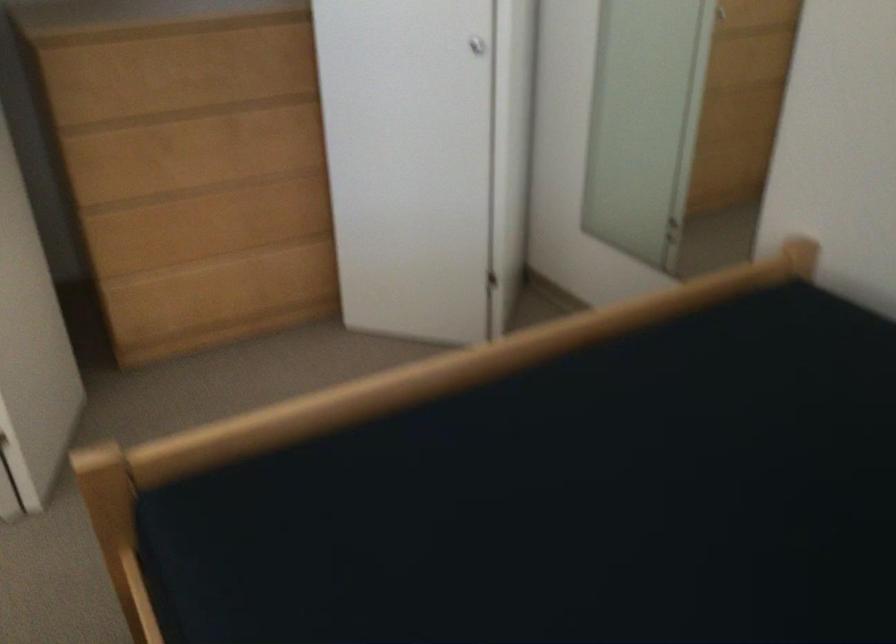
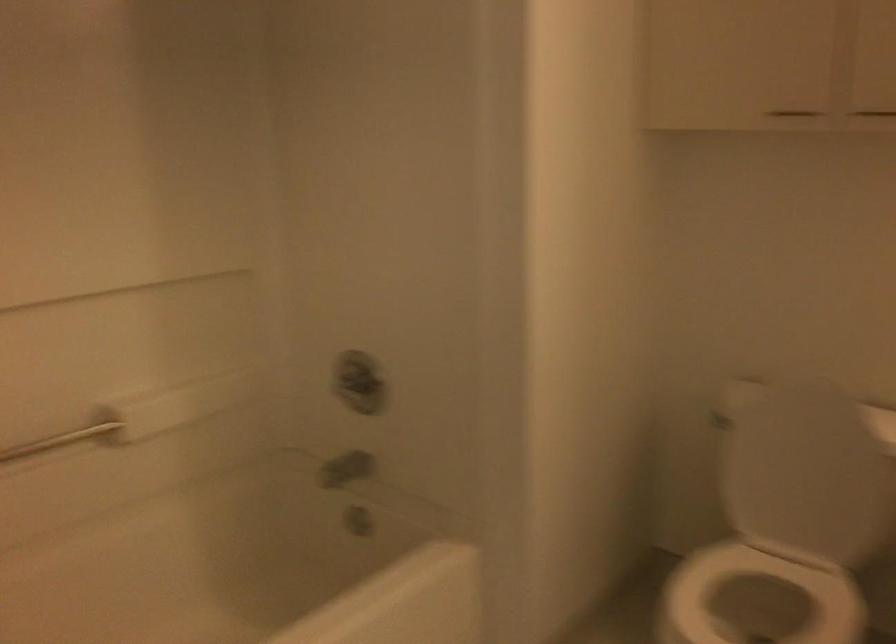
In a continuous first-person perspective shot, in which direction is the camera moving?

The cameraman walked toward left, forward.